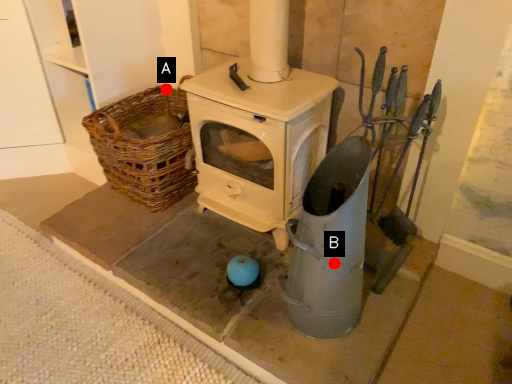
Question: Two points are circled on the image, labeled by A and B beside each circle. Which point is farther to the camera?

Choices:
 (A) A is further
 (B) B is further

Answer: (A)